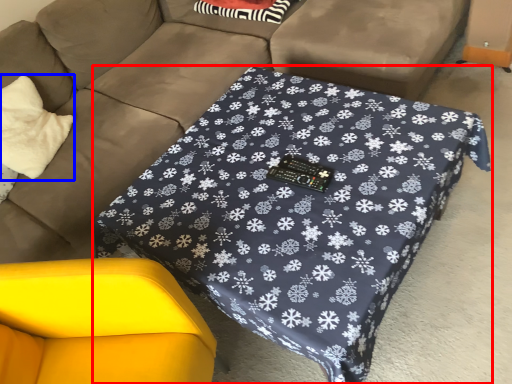
Question: Which of the following is the closest to the observer, table (highlighted by a red box) or throw pillow (highlighted by a blue box)?

Choices:
 (A) table
 (B) throw pillow

Answer: (A)